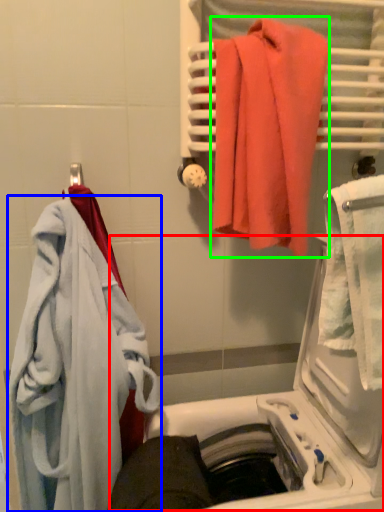
Question: Based on their relative distances, which object is nearer to dish washer (highlighted by a red box)? Choose from towel (highlighted by a blue box) and towel (highlighted by a green box).

Choices:
 (A) towel
 (B) towel

Answer: (A)